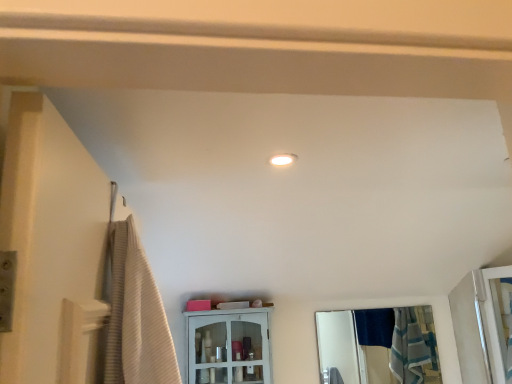
Question: Would you say clear glass screen door at right is part of white glossy cabinet at center's contents?

Choices:
 (A) yes
 (B) no

Answer: (B)

Question: Is white glossy cabinet at center facing away from clear glass screen door at right?

Choices:
 (A) no
 (B) yes

Answer: (A)

Question: Could you tell me if white glossy cabinet at center is facing clear glass screen door at right?

Choices:
 (A) yes
 (B) no

Answer: (B)

Question: Is white glossy cabinet at center outside of clear glass screen door at right?

Choices:
 (A) no
 (B) yes

Answer: (B)

Question: Does white glossy cabinet at center have a greater height compared to clear glass screen door at right?

Choices:
 (A) no
 (B) yes

Answer: (A)

Question: Considering the positions of clear glass screen door at right and white glossy cabinet at center in the image, is clear glass screen door at right wider or thinner than white glossy cabinet at center?

Choices:
 (A) wide
 (B) thin

Answer: (A)

Question: Is clear glass screen door at right taller or shorter than white glossy cabinet at center?

Choices:
 (A) tall
 (B) short

Answer: (A)

Question: From the image's perspective, is clear glass screen door at right located above or below white glossy cabinet at center?

Choices:
 (A) below
 (B) above

Answer: (B)

Question: From a real-world perspective, relative to white glossy cabinet at center, is clear glass screen door at right vertically above or below?

Choices:
 (A) below
 (B) above

Answer: (A)

Question: From their relative heights in the image, would you say clear glass mirror at center is taller or shorter than white glossy cabinet at center?

Choices:
 (A) short
 (B) tall

Answer: (B)

Question: Is clear glass mirror at center wider or thinner than white glossy cabinet at center?

Choices:
 (A) wide
 (B) thin

Answer: (B)

Question: Considering the relative positions of clear glass mirror at center and white glossy cabinet at center in the image provided, is clear glass mirror at center to the left or to the right of white glossy cabinet at center?

Choices:
 (A) right
 (B) left

Answer: (A)

Question: Considering their positions, is clear glass mirror at center located in front of or behind white glossy cabinet at center?

Choices:
 (A) front
 (B) behind

Answer: (B)

Question: Considering the positions of point (472, 352) and point (350, 380), is point (472, 352) closer or farther from the camera than point (350, 380)?

Choices:
 (A) closer
 (B) farther

Answer: (A)

Question: Considering the positions of clear glass screen door at right and clear glass mirror at center in the image, is clear glass screen door at right wider or thinner than clear glass mirror at center?

Choices:
 (A) wide
 (B) thin

Answer: (A)